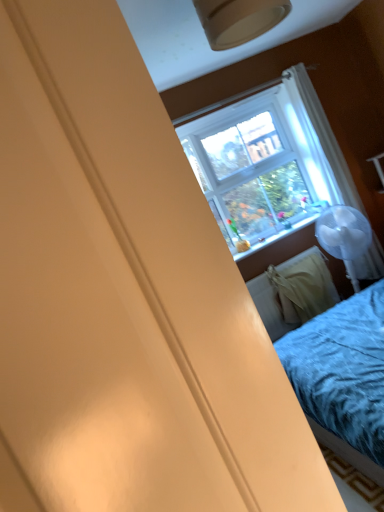
I want to click on white fabric radiator at lower right, so click(293, 292).

This screenshot has height=512, width=384. There is a white fabric radiator at lower right. In order to click on window sill above it (from a real-world perspective) in this screenshot , I will do `click(282, 243)`.

Between point (239, 261) and point (285, 270), which one is positioned in front?

The point (239, 261) is closer.

From the image's perspective, does matte plastic window sill at center appear lower than white fabric radiator at lower right?

No.

Is matte plastic window sill at center to the left or to the right of white fabric radiator at lower right in the image?

matte plastic window sill at center is positioned on white fabric radiator at lower right's left side.

Would you say white fabric radiator at lower right is to the left or to the right of white sheer curtain at upper right in the picture?

In the image, white fabric radiator at lower right appears on the left side of white sheer curtain at upper right.

Looking at this image, is white fabric radiator at lower right turned away from white sheer curtain at upper right?

No, white fabric radiator at lower right is not facing away from white sheer curtain at upper right.

From the image's perspective, is white fabric radiator at lower right located above or below white sheer curtain at upper right?

Clearly, from the image's perspective, white fabric radiator at lower right is below white sheer curtain at upper right.

Between white fabric radiator at lower right and white sheer curtain at upper right, which one has smaller width?

Thinner between the two is white sheer curtain at upper right.

Can you see white sheer curtain at upper right touching matte plastic window sill at center?

No.

Does white sheer curtain at upper right turn towards matte plastic window sill at center?

No, white sheer curtain at upper right does not turn towards matte plastic window sill at center.

Where is `window sill on the left of white sheer curtain at upper right`? Image resolution: width=384 pixels, height=512 pixels. window sill on the left of white sheer curtain at upper right is located at coordinates (282, 243).

Who is shorter, white sheer curtain at upper right or matte plastic window sill at center?

matte plastic window sill at center.

From the image's perspective, would you say white fabric radiator at lower right is positioned over matte plastic window sill at center?

No, from the image's perspective, white fabric radiator at lower right is not on top of matte plastic window sill at center.

Would you say matte plastic window sill at center is part of white fabric radiator at lower right's contents?

No, matte plastic window sill at center is located outside of white fabric radiator at lower right.

Considering the relative sizes of white fabric radiator at lower right and matte plastic window sill at center in the image provided, is white fabric radiator at lower right bigger than matte plastic window sill at center?

Indeed, white fabric radiator at lower right has a larger size compared to matte plastic window sill at center.

Who is shorter, white fabric radiator at lower right or matte plastic window sill at center?

matte plastic window sill at center is shorter.

From a real-world perspective, relative to white sheer curtain at upper right, is matte plastic window sill at center vertically above or below?

matte plastic window sill at center is below white sheer curtain at upper right.

Can you confirm if matte plastic window sill at center is positioned to the right of white sheer curtain at upper right?

No, matte plastic window sill at center is not to the right of white sheer curtain at upper right.

Would you say matte plastic window sill at center is a long distance from white sheer curtain at upper right?

No, matte plastic window sill at center is not far from white sheer curtain at upper right.

Would you say matte plastic window sill at center is outside white sheer curtain at upper right?

matte plastic window sill at center lies outside white sheer curtain at upper right's area.

Which is less distant, (352,196) or (312,290)?

Point (312,290)

Does white sheer curtain at upper right have a greater height compared to white fabric radiator at lower right?

Yes.

Could you tell me if white sheer curtain at upper right is turned towards white fabric radiator at lower right?

No, white sheer curtain at upper right is not aimed at white fabric radiator at lower right.

In the image, there is a matte plastic window sill at center. At what (x,y) coordinates should I click in order to perform the action: click on radiator below it (from the image's perspective). Please return your answer as a coordinate pair (x, y). The width and height of the screenshot is (384, 512). Looking at the image, I should click on (293, 292).

Locate an element on the screen. This screenshot has width=384, height=512. curtain positioned vertically above the white fabric radiator at lower right (from a real-world perspective) is located at coordinates (320, 140).

Looking at the image, which one is located further to matte plastic window sill at center, white sheer curtain at upper right or white fabric radiator at lower right?

white sheer curtain at upper right is further to matte plastic window sill at center.

Estimate the real-world distances between objects in this image. Which object is closer to white fabric radiator at lower right, white sheer curtain at upper right or matte plastic window sill at center?

matte plastic window sill at center is positioned closer to the anchor white fabric radiator at lower right.

Estimate the real-world distances between objects in this image. Which object is further from matte plastic window sill at center, white fabric radiator at lower right or white sheer curtain at upper right?

white sheer curtain at upper right is positioned further to the anchor matte plastic window sill at center.

When comparing their distances from white fabric radiator at lower right, does matte plastic window sill at center or white sheer curtain at upper right seem closer?

matte plastic window sill at center.

From the image, which object appears to be farther from white sheer curtain at upper right, matte plastic window sill at center or white fabric radiator at lower right?

Based on the image, white fabric radiator at lower right appears to be further to white sheer curtain at upper right.

Looking at the image, which one is located further to white sheer curtain at upper right, white fabric radiator at lower right or matte plastic window sill at center?

white fabric radiator at lower right.

Where is `window sill that lies between white sheer curtain at upper right and white fabric radiator at lower right from top to bottom`? window sill that lies between white sheer curtain at upper right and white fabric radiator at lower right from top to bottom is located at coordinates (282, 243).